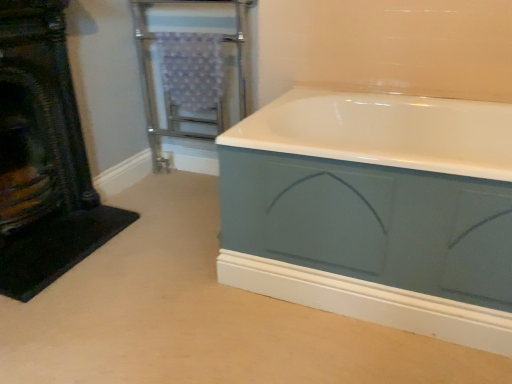
Where is `vacant area to the left of matte blue bathtub at center`? The image size is (512, 384). vacant area to the left of matte blue bathtub at center is located at coordinates (160, 268).